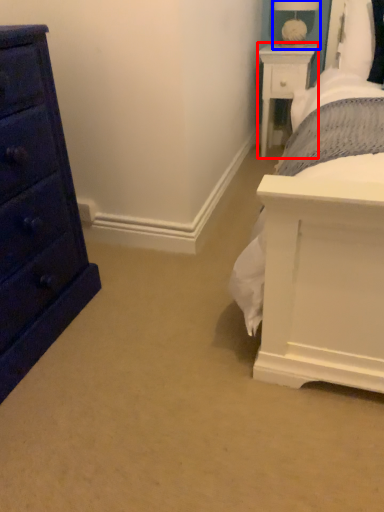
Question: Which of the following is the closest to the observer, nightstand (highlighted by a red box) or table lamp (highlighted by a blue box)?

Choices:
 (A) nightstand
 (B) table lamp

Answer: (B)